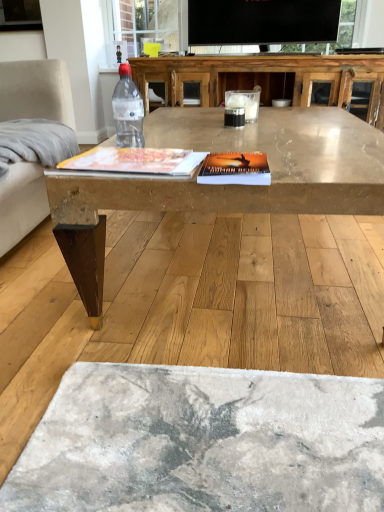
Question: Does light gray fabric armchair at left have a greater width compared to matte wooden coffee table at center?

Choices:
 (A) yes
 (B) no

Answer: (B)

Question: From a real-world perspective, is light gray fabric armchair at left on matte wooden coffee table at center?

Choices:
 (A) no
 (B) yes

Answer: (B)

Question: Can you confirm if light gray fabric armchair at left is thinner than matte wooden coffee table at center?

Choices:
 (A) yes
 (B) no

Answer: (A)

Question: Is light gray fabric armchair at left placed right next to matte wooden coffee table at center?

Choices:
 (A) yes
 (B) no

Answer: (B)

Question: Can you confirm if light gray fabric armchair at left is bigger than matte wooden coffee table at center?

Choices:
 (A) yes
 (B) no

Answer: (B)

Question: From the image's perspective, is light gray fabric armchair at left over matte wooden coffee table at center?

Choices:
 (A) no
 (B) yes

Answer: (B)

Question: Does matte wooden coffee table at center have a greater height compared to clear glass table at center?

Choices:
 (A) yes
 (B) no

Answer: (B)

Question: Is clear glass table at center at the back of matte wooden coffee table at center?

Choices:
 (A) yes
 (B) no

Answer: (B)

Question: Is matte wooden coffee table at center to the right of clear glass table at center from the viewer's perspective?

Choices:
 (A) yes
 (B) no

Answer: (B)

Question: Can you confirm if matte wooden coffee table at center is wider than clear glass table at center?

Choices:
 (A) yes
 (B) no

Answer: (A)

Question: Does matte wooden coffee table at center appear on the left side of clear glass table at center?

Choices:
 (A) yes
 (B) no

Answer: (A)

Question: Does matte wooden coffee table at center have a smaller size compared to clear glass table at center?

Choices:
 (A) yes
 (B) no

Answer: (B)

Question: Is light gray fabric armchair at left oriented away from transparent plastic bottle at center?

Choices:
 (A) no
 (B) yes

Answer: (A)